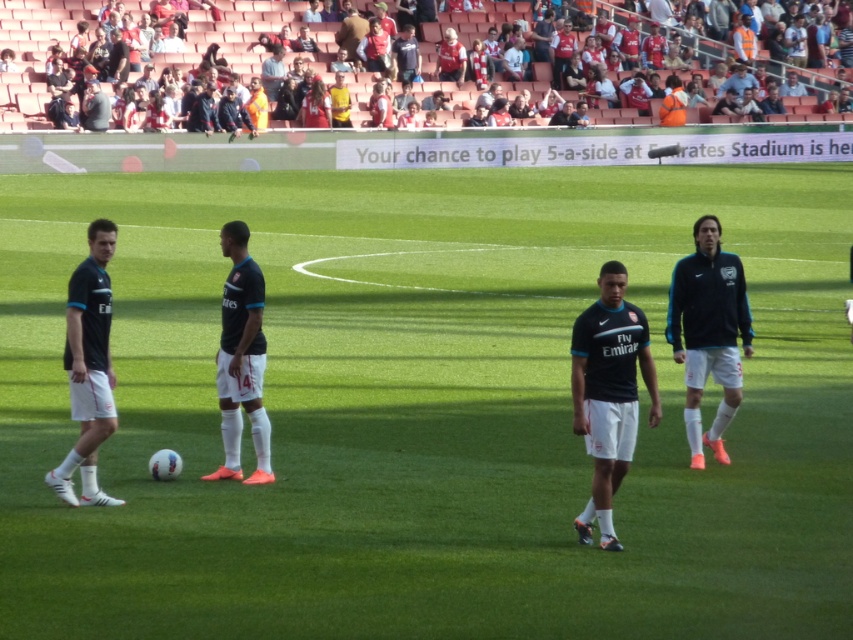
You are a photographer at the Emirates Stadium soccer match. You want to take a photo of the black jersey at upper center. Where should you aim your camera to capture it?

You should aim your camera at point (230, 35) to capture the black jersey at upper center.

Based on the coordinates provided, which object is located at point (230, 35) in the image?

The point (230, 35) corresponds to the black jersey at upper center.

You are a photographer at Emirates Stadium and want to capture a photo of both the black jersey at upper center and the matte black jersey at center in a single shot. Based on their positions, which jersey should you focus on first to ensure both are in frame?

You should focus on the matte black jersey at center first because the black jersey at upper center is to the left of it, so adjusting the camera to include both from the center outward would keep them in frame.